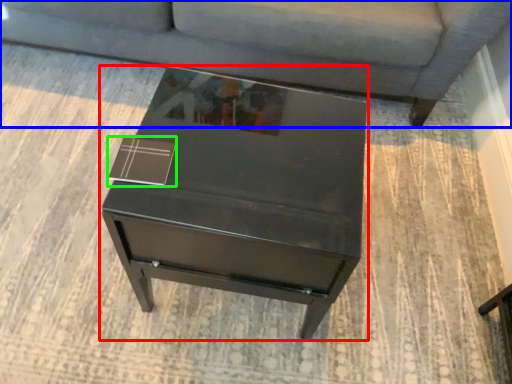
Question: Considering the real-world distances, which object is closest to table (highlighted by a red box)? studio couch (highlighted by a blue box) or square (highlighted by a green box).

Choices:
 (A) studio couch
 (B) square

Answer: (B)